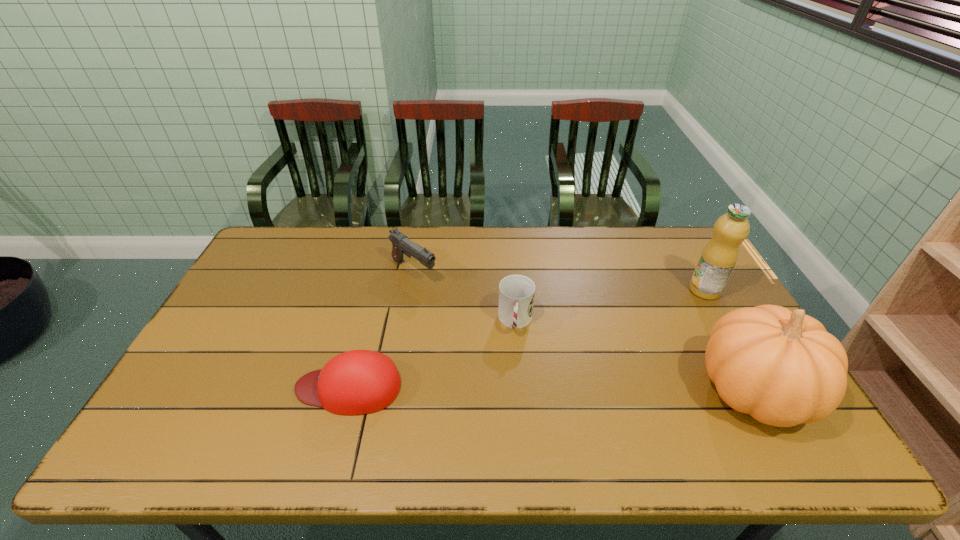
Find the location of a particular element. The image size is (960, 540). vacant position in the image that satisfies the following two spatial constraints: 1. on the front side of the gun; 2. on the left side of the fruit juice is located at coordinates (410, 290).